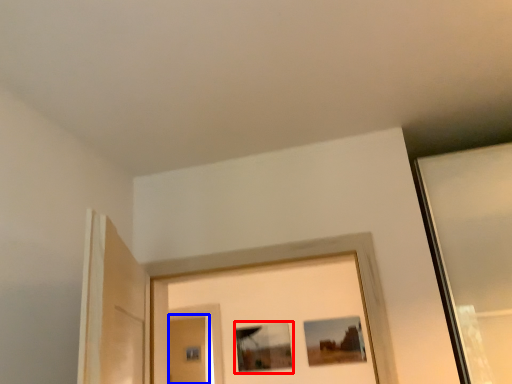
Question: Which object appears farthest to the camera in this image, picture frame (highlighted by a red box) or screen door (highlighted by a blue box)?

Choices:
 (A) picture frame
 (B) screen door

Answer: (B)